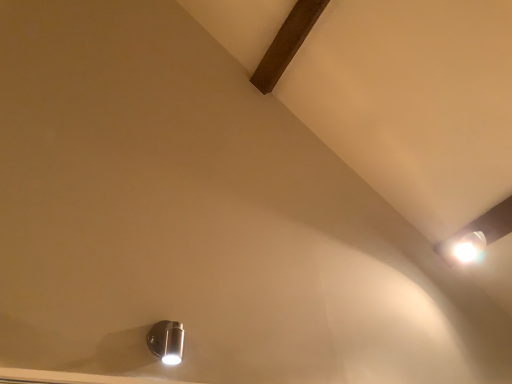
This screenshot has height=384, width=512. What do you see at coordinates (167, 341) in the screenshot?
I see `satin silver spotlight at lower left` at bounding box center [167, 341].

Image resolution: width=512 pixels, height=384 pixels. Identify the location of satin silver spotlight at lower left. (167, 341).

Where is `satin silver spotlight at lower left`? satin silver spotlight at lower left is located at coordinates (167, 341).